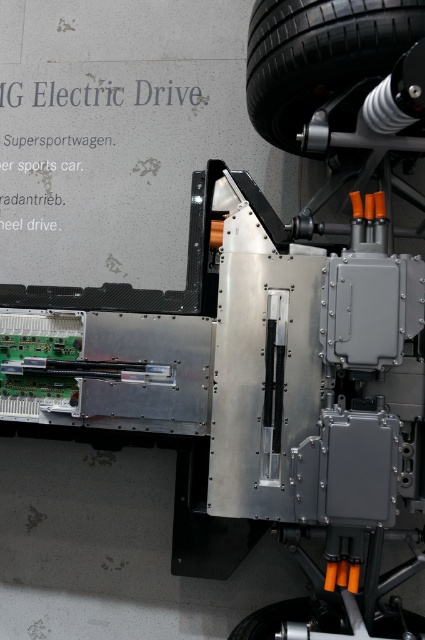
Is black rubber tire at upper right thinner than black rubber tire at lower right?

Yes, black rubber tire at upper right is thinner than black rubber tire at lower right.

This screenshot has width=425, height=640. Find the location of `black rubber tire at upper right`. black rubber tire at upper right is located at coordinates (319, 54).

Which is in front, point (348, 17) or point (286, 609)?

Point (348, 17) is in front.

You are a GUI agent. You are given a task and a screenshot of the screen. Output one action in this format:
    pyautogui.click(x=<x>, y=<y>)
    Task: Click on the black rubber tire at upper right
    The width and height of the screenshot is (425, 640).
    Given the screenshot: What is the action you would take?
    pyautogui.click(x=319, y=54)